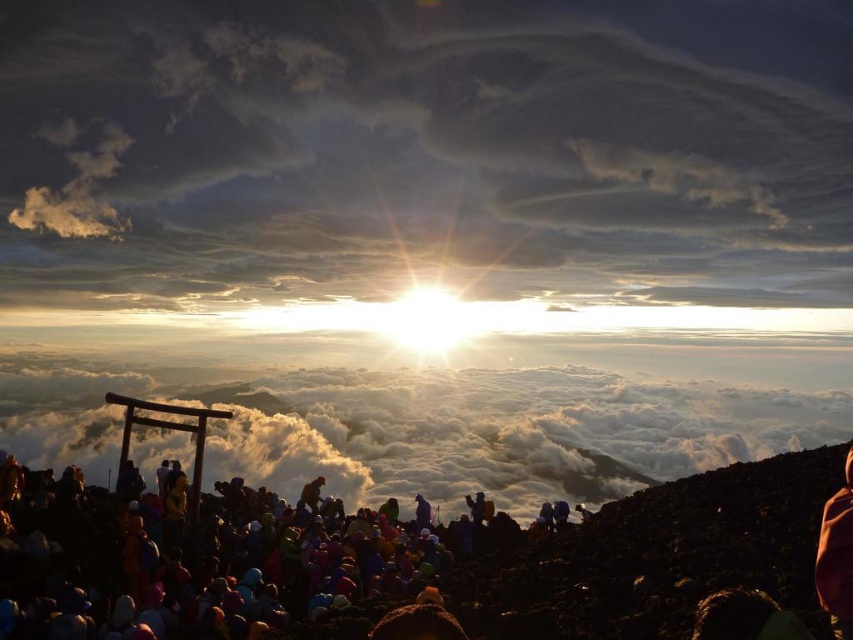
Question: Which of these objects is positioned closest to the orange fabric person at center?

Choices:
 (A) white fluffy cloud at center
 (B) multicolored fabric at lower center

Answer: (B)

Question: Can you confirm if multicolored fabric at lower center is wider than orange fabric person at center?

Choices:
 (A) no
 (B) yes

Answer: (B)

Question: Does cloudy sky at upper center come in front of white fluffy cloud at center?

Choices:
 (A) yes
 (B) no

Answer: (B)

Question: Which object is farther from the camera taking this photo?

Choices:
 (A) multicolored fabric at lower center
 (B) white fluffy cloud at center
 (C) orange fabric person at center
 (D) cloudy sky at upper center

Answer: (D)

Question: Is cloudy sky at upper center closer to the viewer compared to orange fabric person at center?

Choices:
 (A) yes
 (B) no

Answer: (B)

Question: Which object is the farthest from the cloudy sky at upper center?

Choices:
 (A) multicolored fabric at lower center
 (B) orange fabric person at center

Answer: (B)